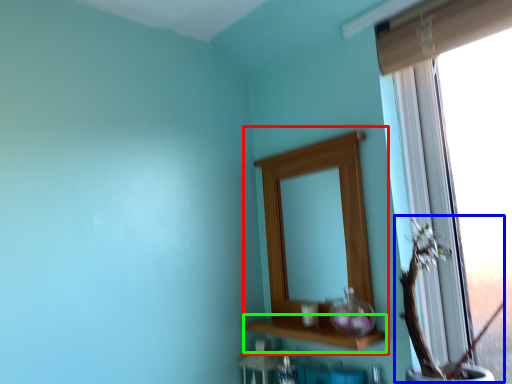
Question: Estimate the real-world distances between objects in this image. Which object is closer to medicine cabinet (highlighted by a red box), floral arrangement (highlighted by a blue box) or window sill (highlighted by a green box)?

Choices:
 (A) floral arrangement
 (B) window sill

Answer: (B)